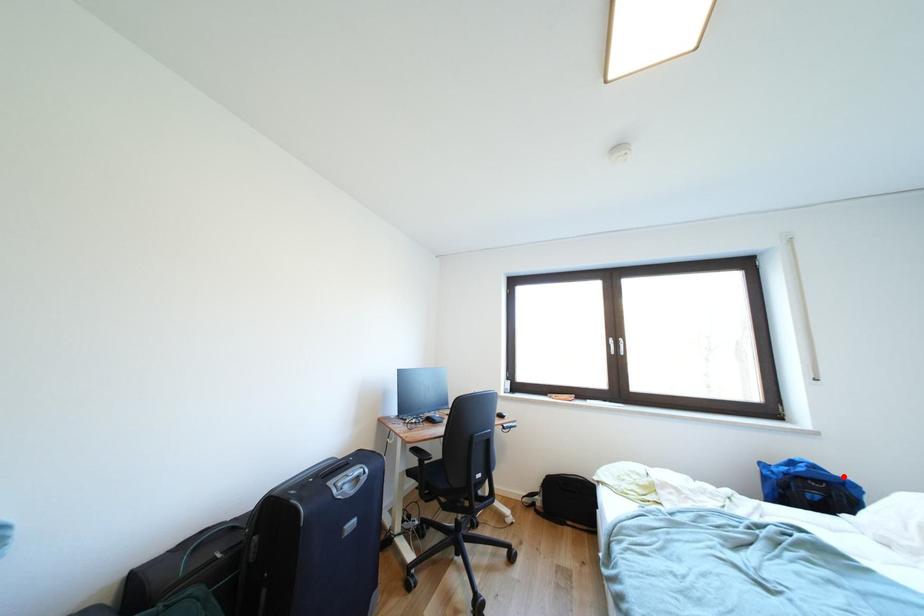
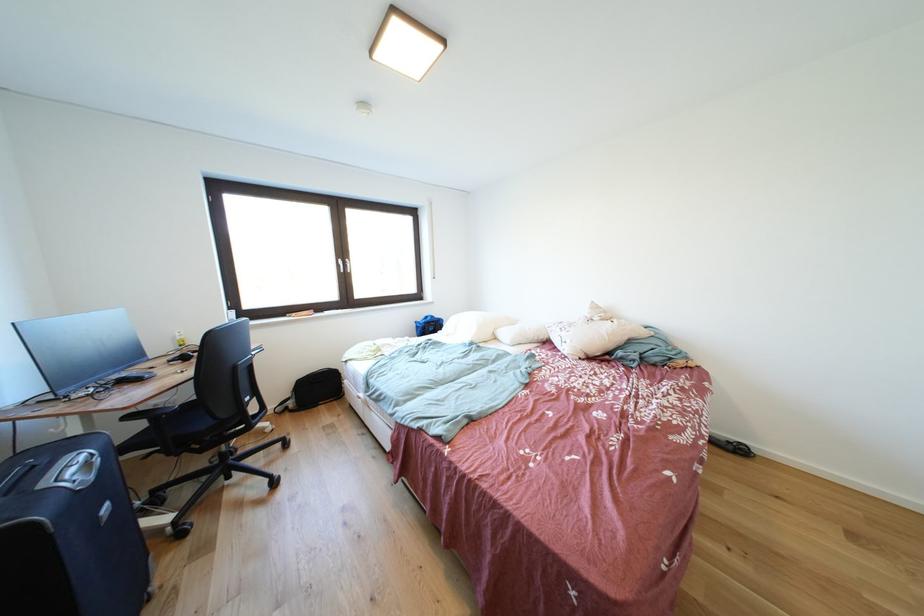
Find the pixel in the second image that matches the highlighted location in the first image.

(445, 321)